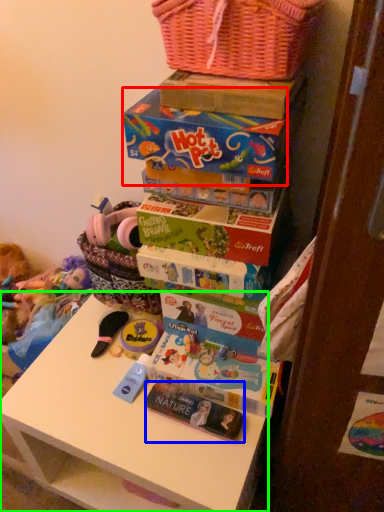
Question: Considering the real-world distances, which object is farthest from storage box (highlighted by a red box)? magazine (highlighted by a blue box) or table (highlighted by a green box)?

Choices:
 (A) magazine
 (B) table

Answer: (B)